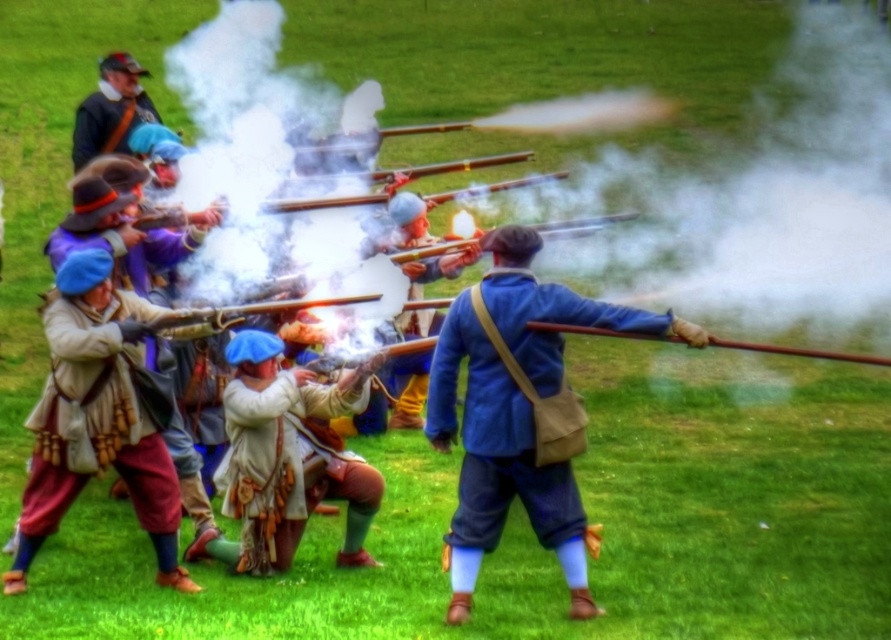
Question: Does blue fabric coat at center appear on the right side of light beige fabric coat at center?

Choices:
 (A) no
 (B) yes

Answer: (B)

Question: Which is farther from the wooden smooth gun at center?

Choices:
 (A) light beige fabric coat at center
 (B) white leather boots at center
 (C) wooden smooth rifle at center
 (D) blue fabric coat at center

Answer: (C)

Question: Which object is farther from the camera taking this photo?

Choices:
 (A) wooden smooth gun at center
 (B) matte brown leather hat at upper left
 (C) blue fabric coat at center
 (D) light beige fabric coat at center

Answer: (B)

Question: Does light beige fabric coat at center have a greater width compared to matte brown leather hat at upper left?

Choices:
 (A) yes
 (B) no

Answer: (B)

Question: Is blue fabric coat at center below white leather boots at center?

Choices:
 (A) no
 (B) yes

Answer: (A)

Question: Which point is farther to the camera?

Choices:
 (A) (451, 358)
 (B) (144, 420)

Answer: (B)